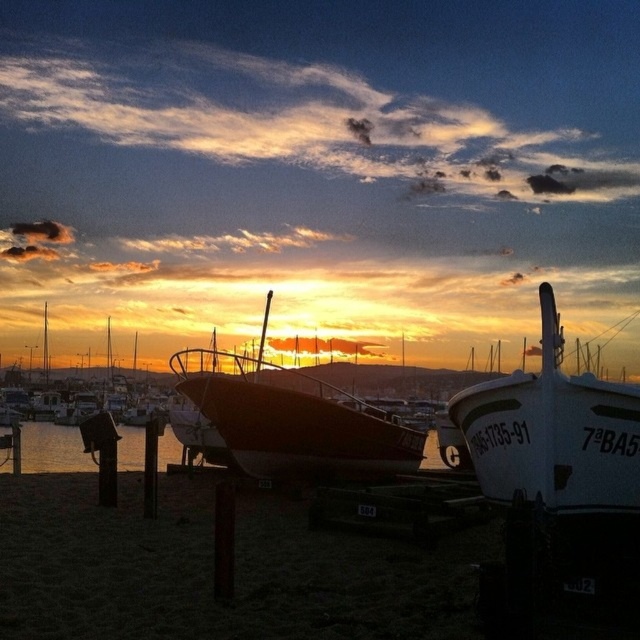
Does white glossy boat at center appear over shiny red boat at center?

No, white glossy boat at center is not above shiny red boat at center.

Between white glossy boat at center and shiny red boat at center, which one appears on the right side from the viewer's perspective?

A: Positioned to the right is white glossy boat at center.

Image resolution: width=640 pixels, height=640 pixels. Describe the element at coordinates (554, 432) in the screenshot. I see `white glossy boat at center` at that location.

Identify the location of white glossy boat at center. (554, 432).